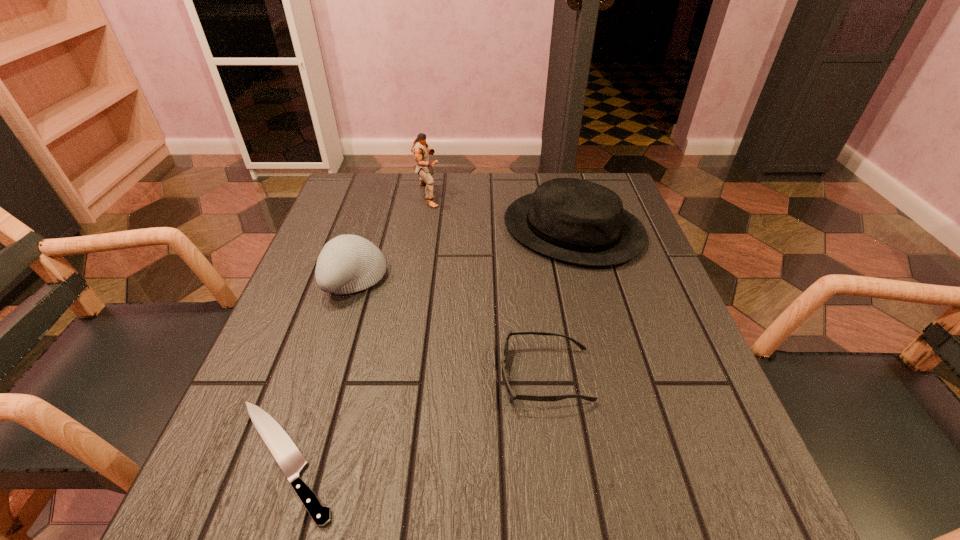
The width and height of the screenshot is (960, 540). I want to click on free spot located on the front-facing side of the sunglasses, so click(283, 376).

Identify the location of vacant space located 0.200m on the front-facing side of the sunglasses. (386, 376).

You are a GUI agent. You are given a task and a screenshot of the screen. Output one action in this format:
    pyautogui.click(x=<x>, y=<y>)
    Task: Click on the vacant space located 0.190m on the back of the steak knife
    The height and width of the screenshot is (540, 960).
    Given the screenshot: What is the action you would take?
    pyautogui.click(x=331, y=318)

Locate an element on the screen. puncher positioned at the far edge is located at coordinates (420, 149).

Find the location of a particular element. The image size is (960, 540). fedora present at the far edge is located at coordinates [x=573, y=220].

Where is `object that is at the near edge`? The height and width of the screenshot is (540, 960). object that is at the near edge is located at coordinates (290, 459).

Find the location of a particular element. Image resolution: width=960 pixels, height=540 pixels. beanie that is at the left edge is located at coordinates (347, 264).

This screenshot has height=540, width=960. What are the coordinates of `steak knife positioned at the left edge` in the screenshot? It's located at (290, 459).

Where is `object at the right edge`? object at the right edge is located at coordinates (x=573, y=220).

Where is `object located in the near left corner section of the desktop`? object located in the near left corner section of the desktop is located at coordinates (290, 459).